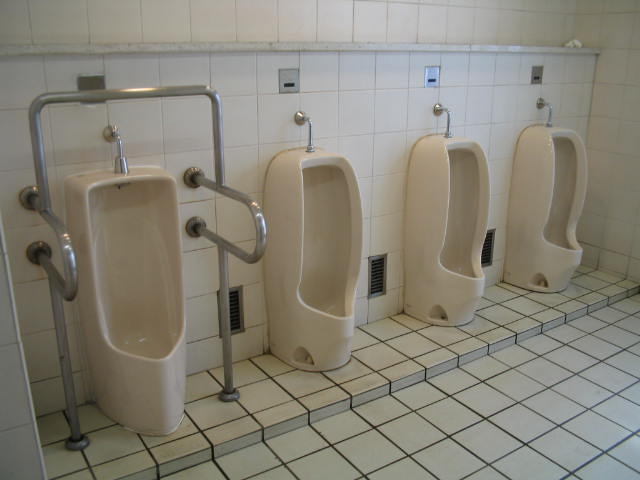
You are a GUI agent. You are given a task and a screenshot of the screen. Output one action in this format:
    pyautogui.click(x=<x>, y=<y>)
    Task: Click on the metal top of urinal attached to wall
    
    Given the screenshot: What is the action you would take?
    pyautogui.click(x=300, y=117), pyautogui.click(x=109, y=133), pyautogui.click(x=438, y=109), pyautogui.click(x=541, y=102)